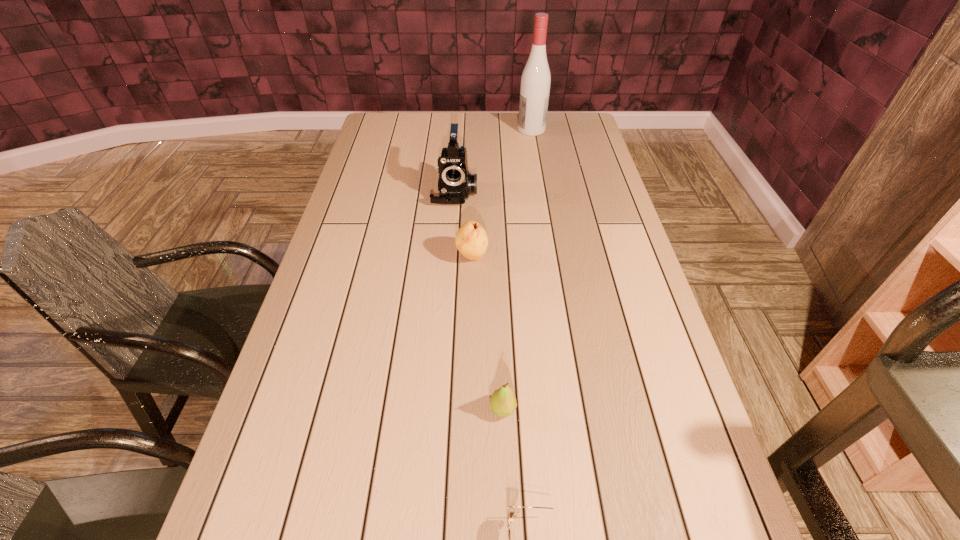
You are a GUI agent. You are given a task and a screenshot of the screen. Output one action in this format:
    pyautogui.click(x=<x>, y=<y>)
    Task: Click on the vacant space that's between the third farthest object and the tallest object
    This screenshot has height=540, width=960.
    Given the screenshot: What is the action you would take?
    pyautogui.click(x=502, y=193)

What are the coordinates of `empty space that is in between the shorter pear and the camcorder` in the screenshot? It's located at (479, 301).

Choose which object is the fourth nearest neighbor to the fourth nearest object. Please provide its 2D coordinates. Your answer should be formatted as a tuple, i.e. [(x, y)], where the tuple contains the x and y coordinates of a point satisfying the conditions above.

[(512, 512)]

Point out which object is positioned as the third nearest to the nearer pear. Please provide its 2D coordinates. Your answer should be formatted as a tuple, i.e. [(x, y)], where the tuple contains the x and y coordinates of a point satisfying the conditions above.

[(455, 184)]

In order to click on blank area in the image that satisfies the following two spatial constraints: 1. on the lens mount of the second farthest object; 2. on the right side of the farther pear in this screenshot , I will do `click(450, 257)`.

I want to click on free spot that satisfies the following two spatial constraints: 1. on the label of the alcohol; 2. on the lens mount of the second tallest object, so click(542, 192).